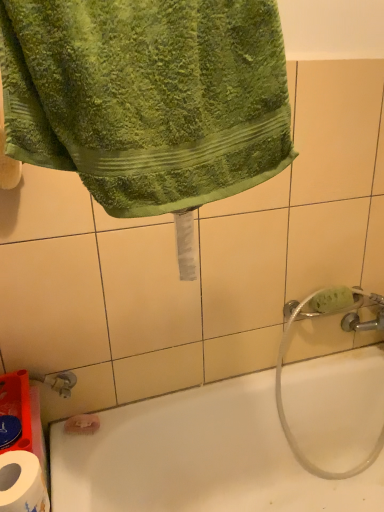
From the picture: Measure the distance between point (370, 457) and camera.

They are 4.47 feet apart.

Find the location of a particular element. white glossy bathtub at lower left is located at coordinates tap(198, 458).

In order to click on green sponge at right in this screenshot , I will do `click(332, 300)`.

From the picture: Is white paper at lower left bigger or smaller than white glossy bathtub at lower left?

In the image, white paper at lower left appears to be smaller than white glossy bathtub at lower left.

Is white paper at lower left to the left of white glossy bathtub at lower left from the viewer's perspective?

Correct, you'll find white paper at lower left to the left of white glossy bathtub at lower left.

From the image's perspective, is white paper at lower left below white glossy bathtub at lower left?

No, from the image's perspective, white paper at lower left is not below white glossy bathtub at lower left.

Is green terry cloth towel at upper left far away from white glossy bathtub at lower left?

No, there isn't a large distance between green terry cloth towel at upper left and white glossy bathtub at lower left.

Is green terry cloth towel at upper left wider than white glossy bathtub at lower left?

No, green terry cloth towel at upper left is not wider than white glossy bathtub at lower left.

From a real-world perspective, is green terry cloth towel at upper left under white glossy bathtub at lower left?

No, from a real-world perspective, green terry cloth towel at upper left is not beneath white glossy bathtub at lower left.

Is green terry cloth towel at upper left taller than white glossy bathtub at lower left?

In fact, green terry cloth towel at upper left may be shorter than white glossy bathtub at lower left.

Is point (326, 298) behind point (15, 508)?

Yes.

Would you say green sponge at right is inside or outside white paper at lower left?

green sponge at right lies outside white paper at lower left.

Consider the image. Considering the sizes of green sponge at right and white paper at lower left in the image, is green sponge at right wider or thinner than white paper at lower left?

Clearly, green sponge at right has less width compared to white paper at lower left.

Consider the image. Considering the positions of objects green terry cloth towel at upper left and green sponge at right in the image provided, who is more to the left, green terry cloth towel at upper left or green sponge at right?

green terry cloth towel at upper left.

From a real-world perspective, is green terry cloth towel at upper left physically below green sponge at right?

No.

Based on the photo, can you tell me how much green terry cloth towel at upper left and green sponge at right differ in facing direction?

There is a 1.74-degree angle between the facing directions of green terry cloth towel at upper left and green sponge at right.

Between green terry cloth towel at upper left and green sponge at right, which one has larger size?

With larger size is green terry cloth towel at upper left.

Would you consider transparent rubber garden hose at lower right to be distant from green terry cloth towel at upper left?

That's not correct — transparent rubber garden hose at lower right is a little close to green terry cloth towel at upper left.

Can you confirm if transparent rubber garden hose at lower right is taller than green terry cloth towel at upper left?

Yes, transparent rubber garden hose at lower right is taller than green terry cloth towel at upper left.

Can we say transparent rubber garden hose at lower right lies outside green terry cloth towel at upper left?

Yes, transparent rubber garden hose at lower right is located beyond the bounds of green terry cloth towel at upper left.

From a real-world perspective, is transparent rubber garden hose at lower right on green terry cloth towel at upper left?

No.

Is green sponge at right taller or shorter than white glossy bathtub at lower left?

Clearly, green sponge at right is shorter compared to white glossy bathtub at lower left.

Is green sponge at right wider than white glossy bathtub at lower left?

No, green sponge at right is not wider than white glossy bathtub at lower left.

Between white glossy bathtub at lower left and green sponge at right, which one has larger size?

white glossy bathtub at lower left.

How different are the orientations of white glossy bathtub at lower left and green sponge at right in degrees?

1.74 degrees separate the facing orientations of white glossy bathtub at lower left and green sponge at right.

This screenshot has height=512, width=384. In the image, there is a white glossy bathtub at lower left. In order to click on soap above it (from the image's perspective) in this screenshot , I will do `click(332, 300)`.

From a real-world perspective, does white glossy bathtub at lower left sit lower than green sponge at right?

Yes, from a real-world perspective, white glossy bathtub at lower left is beneath green sponge at right.

Where is `toilet paper above the white glossy bathtub at lower left (from a real-world perspective)`? The width and height of the screenshot is (384, 512). toilet paper above the white glossy bathtub at lower left (from a real-world perspective) is located at coordinates (22, 483).

Where is `bathtub below the green terry cloth towel at upper left (from the image's perspective)`? The height and width of the screenshot is (512, 384). bathtub below the green terry cloth towel at upper left (from the image's perspective) is located at coordinates (198, 458).

Which object lies further to the anchor point green sponge at right, transparent rubber garden hose at lower right or white paper at lower left?

The object further to green sponge at right is white paper at lower left.

Looking at the image, which one is located further to white glossy bathtub at lower left, green terry cloth towel at upper left or white paper at lower left?

Among the two, green terry cloth towel at upper left is located further to white glossy bathtub at lower left.

Based on the photo, when comparing their distances from white paper at lower left, does white glossy bathtub at lower left or transparent rubber garden hose at lower right seem closer?

white glossy bathtub at lower left lies closer to white paper at lower left than the other object.

Which object lies nearer to the anchor point white paper at lower left, white glossy bathtub at lower left or green terry cloth towel at upper left?

green terry cloth towel at upper left.

From the image, which object appears to be nearer to white paper at lower left, transparent rubber garden hose at lower right or green terry cloth towel at upper left?

green terry cloth towel at upper left lies closer to white paper at lower left than the other object.

From the image, which object appears to be nearer to white glossy bathtub at lower left, green sponge at right or white paper at lower left?

Based on the image, green sponge at right appears to be nearer to white glossy bathtub at lower left.

From the image, which object appears to be nearer to green terry cloth towel at upper left, white paper at lower left or transparent rubber garden hose at lower right?

white paper at lower left is positioned closer to the anchor green terry cloth towel at upper left.

Considering their positions, is green terry cloth towel at upper left positioned closer to white paper at lower left than white glossy bathtub at lower left?

green terry cloth towel at upper left is closer to white paper at lower left.

Find the location of a particular element. toilet paper positioned between green terry cloth towel at upper left and green sponge at right from near to far is located at coordinates (22, 483).

Identify the location of soap between white paper at lower left and transparent rubber garden hose at lower right from left to right. (332, 300).

Image resolution: width=384 pixels, height=512 pixels. I want to click on garden hose between green terry cloth towel at upper left and white glossy bathtub at lower left from top to bottom, so click(289, 426).

Image resolution: width=384 pixels, height=512 pixels. Identify the location of towel between white paper at lower left and transparent rubber garden hose at lower right. (147, 97).